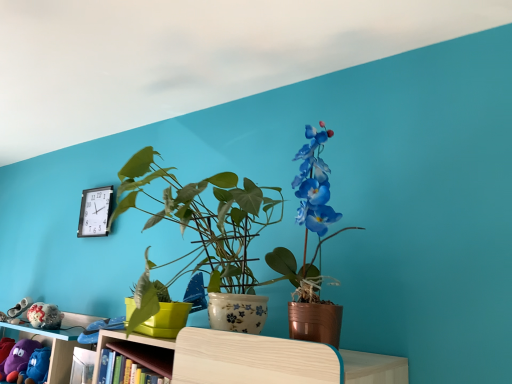
Question: Considering the relative sizes of metallic copper pot at center and black plastic clock at upper left in the image provided, is metallic copper pot at center smaller than black plastic clock at upper left?

Choices:
 (A) yes
 (B) no

Answer: (B)

Question: Can you confirm if metallic copper pot at center is thinner than black plastic clock at upper left?

Choices:
 (A) no
 (B) yes

Answer: (A)

Question: From the image's perspective, is metallic copper pot at center above black plastic clock at upper left?

Choices:
 (A) no
 (B) yes

Answer: (B)

Question: From the image's perspective, is metallic copper pot at center below black plastic clock at upper left?

Choices:
 (A) yes
 (B) no

Answer: (B)

Question: Can you confirm if metallic copper pot at center is positioned to the right of black plastic clock at upper left?

Choices:
 (A) yes
 (B) no

Answer: (A)

Question: In the image, is black plastic clock at upper left positioned in front of or behind purple fabric plush at lower left?

Choices:
 (A) front
 (B) behind

Answer: (B)

Question: Considering the positions of black plastic clock at upper left and purple fabric plush at lower left in the image, is black plastic clock at upper left wider or thinner than purple fabric plush at lower left?

Choices:
 (A) thin
 (B) wide

Answer: (A)

Question: Would you say black plastic clock at upper left is to the left or to the right of purple fabric plush at lower left in the picture?

Choices:
 (A) left
 (B) right

Answer: (B)

Question: Is point (86, 223) closer or farther from the camera than point (26, 344)?

Choices:
 (A) farther
 (B) closer

Answer: (A)

Question: Choose the correct answer: Is metallic copper pot at center inside black plastic clock at upper left or outside it?

Choices:
 (A) inside
 (B) outside

Answer: (B)

Question: From the image's perspective, relative to black plastic clock at upper left, is metallic copper pot at center above or below?

Choices:
 (A) above
 (B) below

Answer: (A)

Question: Considering their positions, is metallic copper pot at center located in front of or behind black plastic clock at upper left?

Choices:
 (A) front
 (B) behind

Answer: (A)

Question: Visually, is metallic copper pot at center positioned to the left or to the right of black plastic clock at upper left?

Choices:
 (A) left
 (B) right

Answer: (B)

Question: Considering their positions, is purple fabric plush at lower left located in front of or behind black plastic clock at upper left?

Choices:
 (A) front
 (B) behind

Answer: (A)

Question: From their relative heights in the image, would you say purple fabric plush at lower left is taller or shorter than black plastic clock at upper left?

Choices:
 (A) tall
 (B) short

Answer: (B)